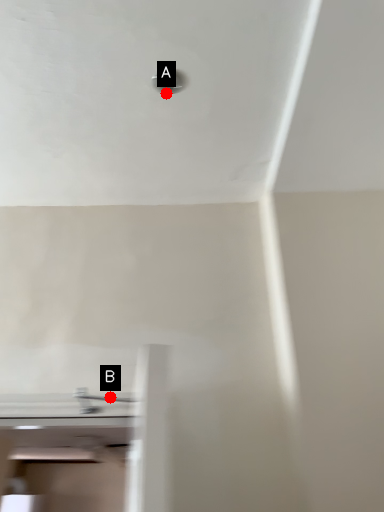
Question: Two points are circled on the image, labeled by A and B beside each circle. Which of the following is the farthest from the observer?

Choices:
 (A) A is further
 (B) B is further

Answer: (B)